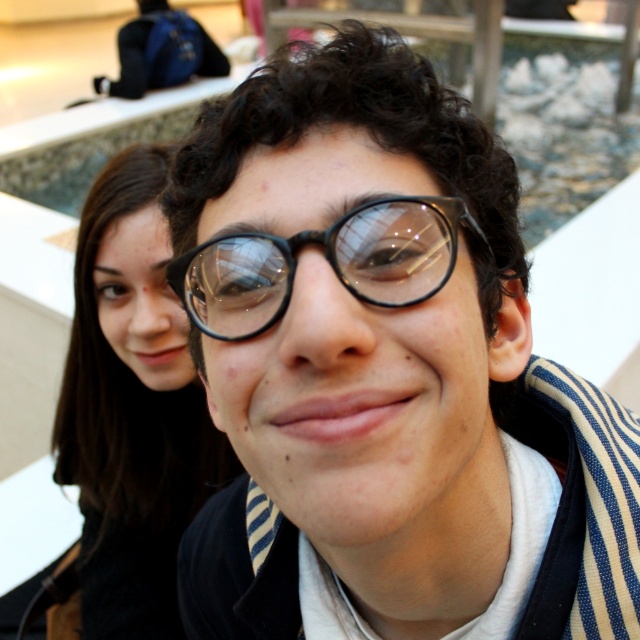
Can you confirm if clear plastic glasses at center is positioned above black matte glasses at center?

No.

What do you see at coordinates (385, 371) in the screenshot? Image resolution: width=640 pixels, height=640 pixels. I see `clear plastic glasses at center` at bounding box center [385, 371].

The image size is (640, 640). What do you see at coordinates (385, 371) in the screenshot?
I see `clear plastic glasses at center` at bounding box center [385, 371].

Find the location of a particular element. clear plastic glasses at center is located at coordinates (385, 371).

Consider the image. Between dark brown hair at left and black matte glasses at center, which one is positioned higher?

black matte glasses at center is higher up.

Who is positioned more to the right, dark brown hair at left or black matte glasses at center?

black matte glasses at center

Describe the element at coordinates (131, 408) in the screenshot. The image size is (640, 640). I see `dark brown hair at left` at that location.

You are a GUI agent. You are given a task and a screenshot of the screen. Output one action in this format:
    pyautogui.click(x=<x>, y=<y>)
    Task: Click on the dark brown hair at left
    The width and height of the screenshot is (640, 640).
    Given the screenshot: What is the action you would take?
    pyautogui.click(x=131, y=408)

Is clear plastic glasses at center closer to camera compared to dark brown hair at left?

Yes, it is.

Does point (276, 568) come behind point (170, 513)?

No.

Locate an element on the screen. The image size is (640, 640). clear plastic glasses at center is located at coordinates (385, 371).